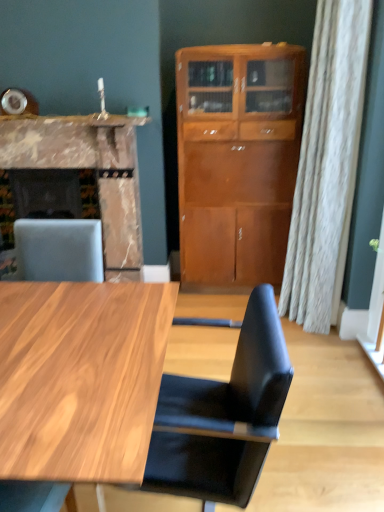
Question: From their relative heights in the image, would you say marble fireplace at left is taller or shorter than marble countertop at upper left?

Choices:
 (A) short
 (B) tall

Answer: (B)

Question: From the image's perspective, relative to marble countertop at upper left, is marble fireplace at left above or below?

Choices:
 (A) above
 (B) below

Answer: (B)

Question: Which object is the farthest from the marble fireplace at left?

Choices:
 (A) black leather chair at center
 (B) light brown wood cabinet at center
 (C) marble countertop at upper left

Answer: (A)

Question: Which of these objects is positioned farthest from the black leather chair at center?

Choices:
 (A) marble fireplace at left
 (B) marble countertop at upper left
 (C) light brown wood cabinet at center

Answer: (B)